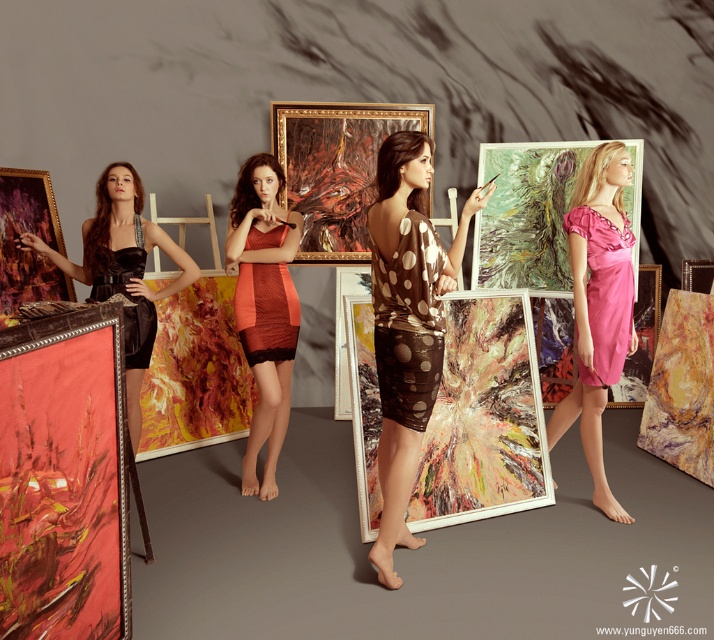
In the art studio scene, there is an oil paint canvas at center and a pink satin dress at right. Which object is positioned more to the left?

The oil paint canvas at center is positioned more to the left than the pink satin dress at right.

You are an art critic analyzing the composition of the image. You notice a point at coordinates (407, 323). What object is located at this point?

The point at coordinates (407, 323) indicates the brown shiny dress at center.

Looking at this image, you are an artist in the studio and want to place a new sculpture exactly where the brown shiny dress at center is currently standing. Where should you place the sculpture in terms of coordinates?

The sculpture should be placed at coordinates point (407, 323), as that is the location of the brown shiny dress at center.